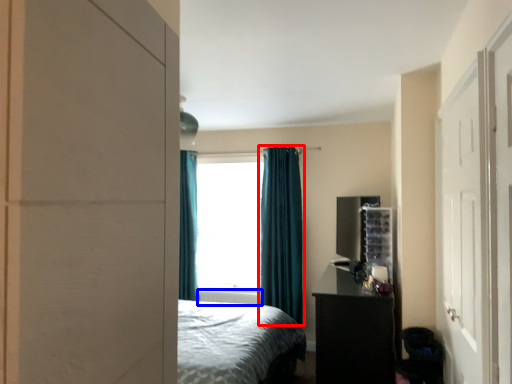
Question: Which of the following is the farthest to the observer, curtain (highlighted by a red box) or radiator (highlighted by a blue box)?

Choices:
 (A) curtain
 (B) radiator

Answer: (B)